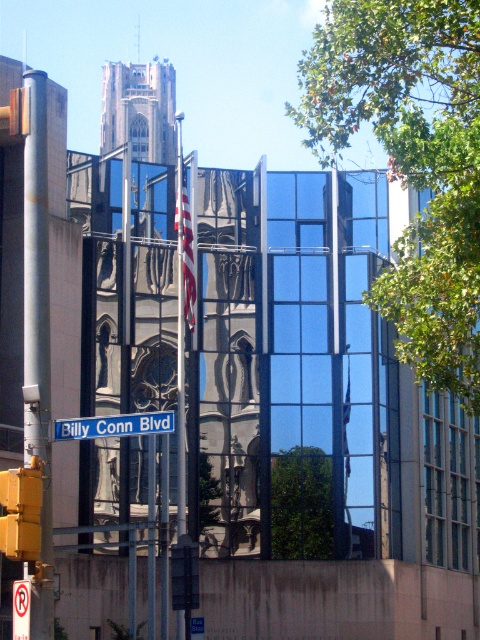
Measure the distance between green leafy tree at upper right and green leafy tree at center.

A distance of 21.90 meters exists between green leafy tree at upper right and green leafy tree at center.

Can you confirm if green leafy tree at upper right is positioned to the right of green leafy tree at center?

Yes, green leafy tree at upper right is to the right of green leafy tree at center.

What do you see at coordinates (412, 163) in the screenshot?
I see `green leafy tree at upper right` at bounding box center [412, 163].

Identify the location of green leafy tree at upper right. (412, 163).

Between yellow matte traffic light at lower left and blue plastic street sign at center, which one has less height?

yellow matte traffic light at lower left

Who is positioned more to the left, yellow matte traffic light at lower left or blue plastic street sign at center?

yellow matte traffic light at lower left is more to the left.

Between point (0, 532) and point (67, 428), which one is positioned behind?

Positioned behind is point (67, 428).

Where is `yellow matte traffic light at lower left`? The width and height of the screenshot is (480, 640). yellow matte traffic light at lower left is located at coordinates (21, 512).

Between point (8, 499) and point (177, 138), which one is positioned behind?

Point (177, 138)

You are a GUI agent. You are given a task and a screenshot of the screen. Output one action in this format:
    pyautogui.click(x=<x>, y=<y>)
    Task: Click on the yellow matte traffic light at lower left
    
    Given the screenshot: What is the action you would take?
    pyautogui.click(x=21, y=512)